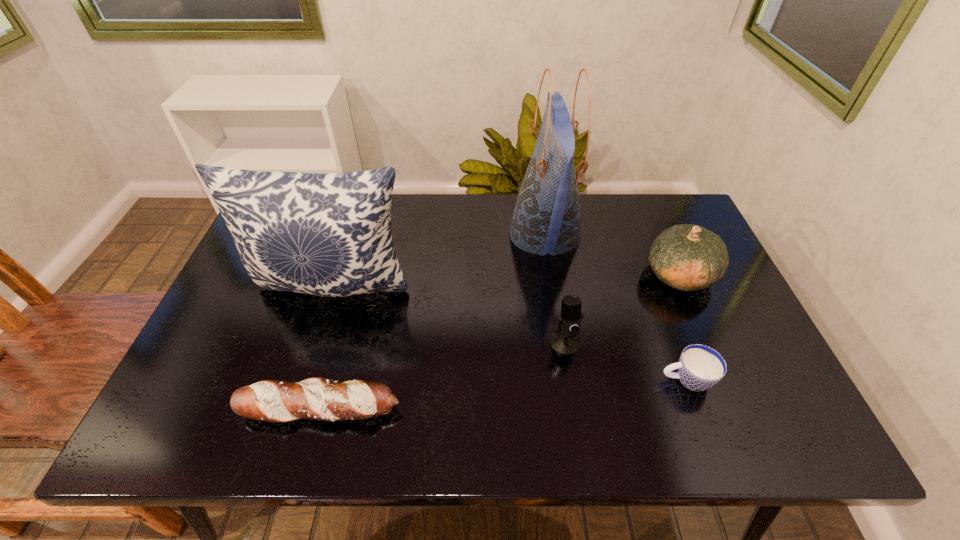
Locate an element on the screen. The height and width of the screenshot is (540, 960). object situated at the near left corner is located at coordinates (317, 398).

Identify the location of vacant space at the far edge of the desktop. This screenshot has height=540, width=960. (420, 216).

Image resolution: width=960 pixels, height=540 pixels. In the image, there is a desktop. Find the location of `free region at the near edge`. free region at the near edge is located at coordinates (507, 417).

At what (x,y) coordinates should I click in order to perform the action: click on free location at the left edge of the desktop. Please return your answer as a coordinate pair (x, y). The image size is (960, 540). Looking at the image, I should click on (251, 368).

Locate an element on the screen. vacant area at the far right corner is located at coordinates (634, 200).

Locate an element on the screen. Image resolution: width=960 pixels, height=540 pixels. free space that is in between the gourd and the cup is located at coordinates (683, 327).

I want to click on empty space between the microphone and the gourd, so click(x=622, y=308).

Identify the location of vacant region between the cushion and the shopping bag. (440, 261).

At what (x,y) coordinates should I click in order to perform the action: click on free space between the second tallest object and the shopping bag. Please return your answer as a coordinate pair (x, y). The image size is (960, 540). Looking at the image, I should click on pyautogui.click(x=440, y=261).

What are the coordinates of `vacant area between the baguet and the fifth shortest object` in the screenshot? It's located at (327, 348).